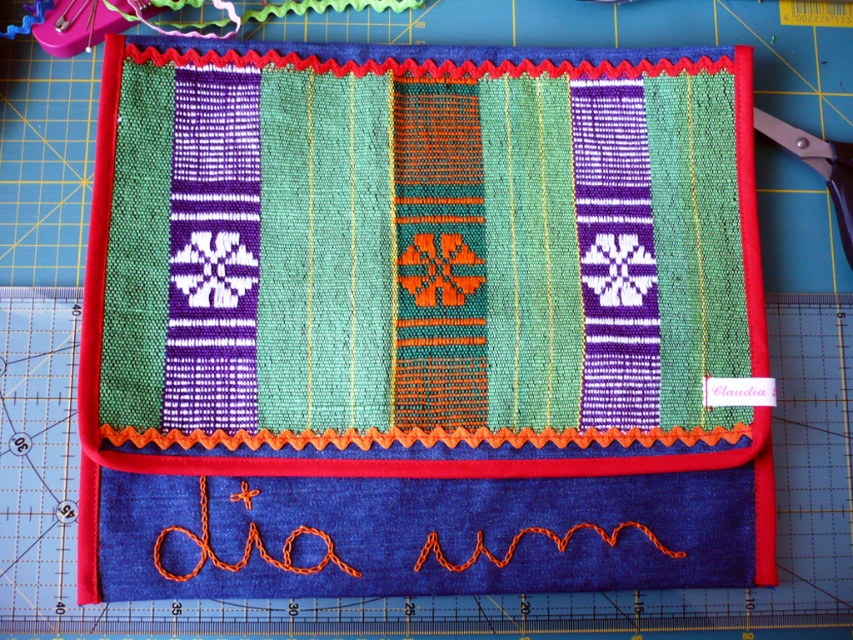
You need to cut the fabric mat using the scissors. Are the black plastic scissors at upper right positioned above the textured fabric mat at center?

Yes, the black plastic scissors at upper right are positioned above the textured fabric mat at center, so you can easily reach them to cut the fabric mat.

From the picture: Where is the textured fabric mat at center located in the image?

The textured fabric mat at center is located at point (419, 323) in the image.

You are examining the handmade fabric item on the cutting mat. There are two points marked on the fabric at coordinates point (204, 275) and point (766, 128). Which point is nearer to you as you look at the fabric?

Point (204, 275) is closer to the camera than point (766, 128), so the point nearer to you is point (204, 275).